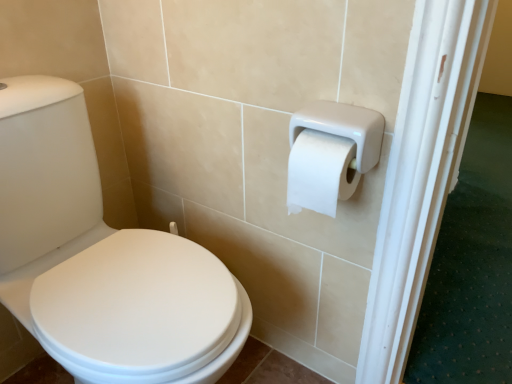
Identify the location of white glossy toilet at upper right. (100, 258).

The width and height of the screenshot is (512, 384). What do you see at coordinates (100, 258) in the screenshot?
I see `white glossy toilet at upper right` at bounding box center [100, 258].

Measure the distance between point (53, 123) and camera.

The depth of point (53, 123) is 34.92 inches.

This screenshot has width=512, height=384. I want to click on white glossy toilet at upper right, so click(x=100, y=258).